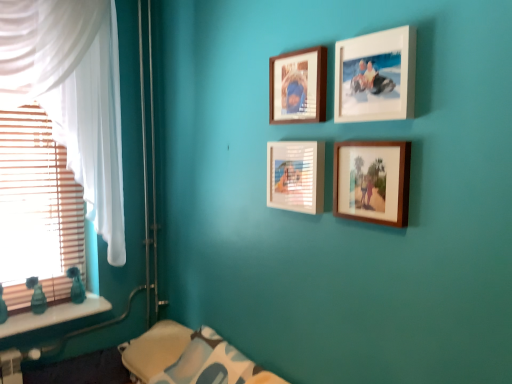
Question: Is white marble window sill at lower left to the right of soft white fabric pillow at lower center from the viewer's perspective?

Choices:
 (A) no
 (B) yes

Answer: (A)

Question: Is there a large distance between white marble window sill at lower left and soft white fabric pillow at lower center?

Choices:
 (A) yes
 (B) no

Answer: (B)

Question: Is white marble window sill at lower left not inside soft white fabric pillow at lower center?

Choices:
 (A) no
 (B) yes

Answer: (B)

Question: From a real-world perspective, is white marble window sill at lower left under soft white fabric pillow at lower center?

Choices:
 (A) no
 (B) yes

Answer: (A)

Question: From the image's perspective, is white marble window sill at lower left on top of soft white fabric pillow at lower center?

Choices:
 (A) no
 (B) yes

Answer: (B)

Question: From a real-world perspective, is white matte picture frame at upper center, the third picture frame ordered from the bottom, positioned above or below white glossy picture frame at center, arranged as the second picture frame when ordered from the bottom?

Choices:
 (A) above
 (B) below

Answer: (A)

Question: In terms of width, does white matte picture frame at upper center, the third picture frame ordered from the bottom, look wider or thinner when compared to white glossy picture frame at center, acting as the 3th picture frame starting from the top?

Choices:
 (A) thin
 (B) wide

Answer: (B)

Question: Does point (389, 114) appear closer or farther from the camera than point (296, 145)?

Choices:
 (A) farther
 (B) closer

Answer: (B)

Question: Is white matte picture frame at upper center, marked as the second picture frame in a top-to-bottom arrangement, inside the boundaries of white glossy picture frame at center, acting as the 3th picture frame starting from the top, or outside?

Choices:
 (A) inside
 (B) outside

Answer: (B)

Question: In terms of size, does white matte picture frame at upper center, the third picture frame ordered from the bottom, appear bigger or smaller than white sheer curtain at left?

Choices:
 (A) big
 (B) small

Answer: (B)

Question: In terms of height, does white matte picture frame at upper center, marked as the second picture frame in a top-to-bottom arrangement, look taller or shorter compared to white sheer curtain at left?

Choices:
 (A) short
 (B) tall

Answer: (A)

Question: Considering the positions of point (345, 92) and point (4, 89), is point (345, 92) closer or farther from the camera than point (4, 89)?

Choices:
 (A) farther
 (B) closer

Answer: (B)

Question: Considering the positions of white matte picture frame at upper center, marked as the second picture frame in a top-to-bottom arrangement, and white sheer curtain at left in the image, is white matte picture frame at upper center, marked as the second picture frame in a top-to-bottom arrangement, wider or thinner than white sheer curtain at left?

Choices:
 (A) thin
 (B) wide

Answer: (A)

Question: In terms of width, does white glossy picture frame at center, arranged as the second picture frame when ordered from the bottom, look wider or thinner when compared to white sheer curtain at left?

Choices:
 (A) thin
 (B) wide

Answer: (A)

Question: Is white glossy picture frame at center, acting as the 3th picture frame starting from the top, in front of or behind white sheer curtain at left in the image?

Choices:
 (A) behind
 (B) front

Answer: (B)